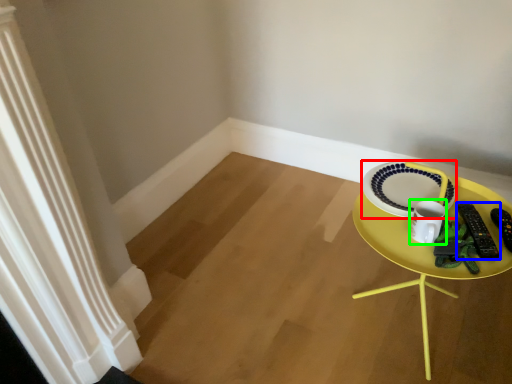
Question: Estimate the real-world distances between objects in this image. Which object is closer to plate (highlighted by a red box), remote control (highlighted by a blue box) or coffee cup (highlighted by a green box)?

Choices:
 (A) remote control
 (B) coffee cup

Answer: (B)